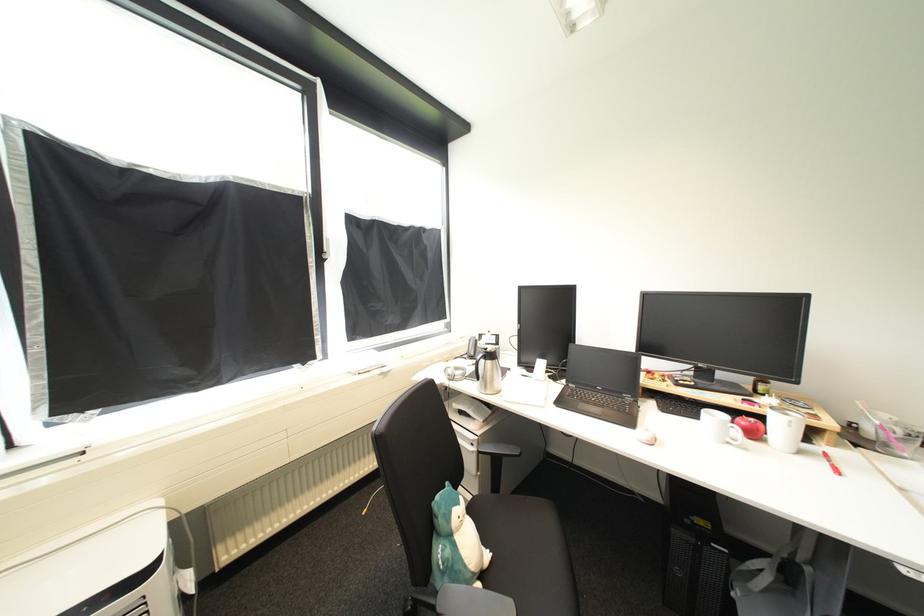
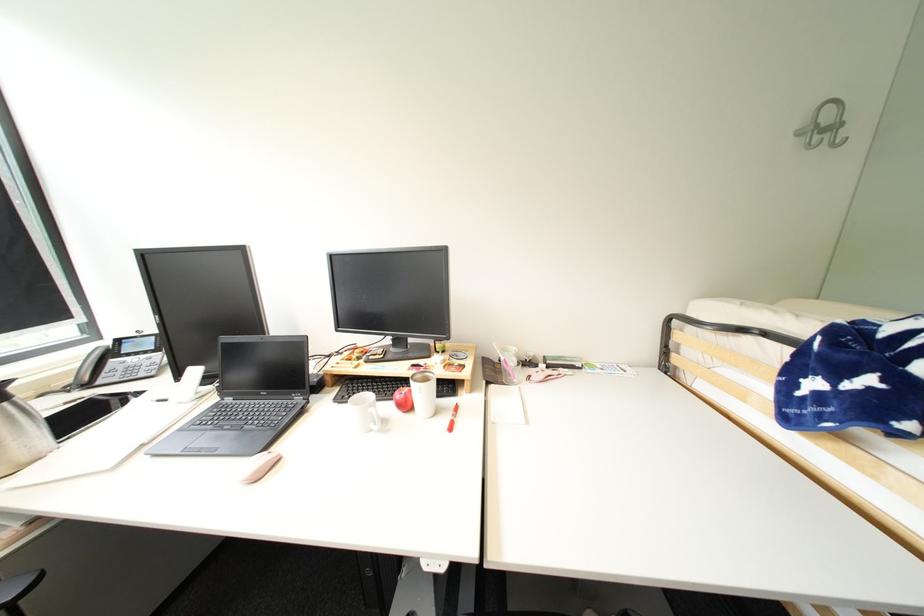
Where in the second image is the point corresponding to point (815, 447) from the first image?

(456, 402)